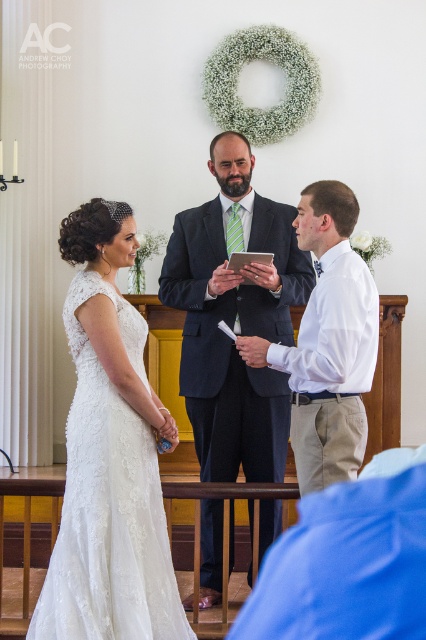
Question: Observing the image, what is the correct spatial positioning of lace fabric dress at left in reference to white cotton shirt at center?

Choices:
 (A) above
 (B) below

Answer: (B)

Question: Which point is closer to the camera taking this photo?

Choices:
 (A) (175, 289)
 (B) (264, 352)
 (C) (161, 499)

Answer: (C)

Question: Does lace fabric dress at left have a larger size compared to dark blue suit at center?

Choices:
 (A) yes
 (B) no

Answer: (B)

Question: Can you confirm if lace fabric dress at left is smaller than dark blue suit at center?

Choices:
 (A) no
 (B) yes

Answer: (B)

Question: Estimate the real-world distances between objects in this image. Which object is closer to the lace fabric dress at left?

Choices:
 (A) white lace dress at left
 (B) dark blue suit at center
 (C) white cotton shirt at center

Answer: (C)

Question: Which point is closer to the camera?

Choices:
 (A) (210, 236)
 (B) (253, 291)
 (C) (336, 404)

Answer: (C)